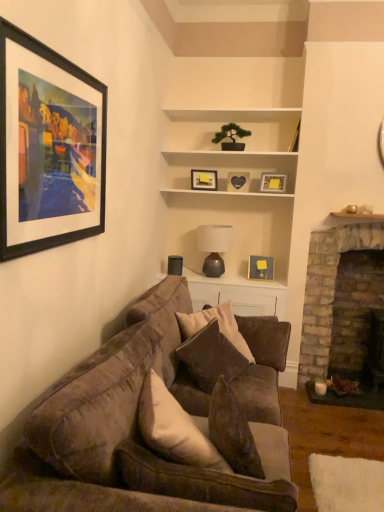
Question: Is white matte cabinet at center thinner than brick fireplace at right?

Choices:
 (A) no
 (B) yes

Answer: (B)

Question: From a real-world perspective, is white matte cabinet at center below brick fireplace at right?

Choices:
 (A) no
 (B) yes

Answer: (A)

Question: From a real-world perspective, is white matte cabinet at center physically above brick fireplace at right?

Choices:
 (A) yes
 (B) no

Answer: (A)

Question: From the image's perspective, is white matte cabinet at center below brick fireplace at right?

Choices:
 (A) yes
 (B) no

Answer: (B)

Question: Does white matte cabinet at center have a smaller size compared to brick fireplace at right?

Choices:
 (A) yes
 (B) no

Answer: (A)

Question: From the image's perspective, is velvet brown couch at lower left, which is counted as the second studio couch, starting from the back, positioned above or below matte gray lamp at center?

Choices:
 (A) above
 (B) below

Answer: (B)

Question: Based on their positions, is velvet brown couch at lower left, which appears as the first studio couch when viewed from the front, located to the left or right of matte gray lamp at center?

Choices:
 (A) left
 (B) right

Answer: (A)

Question: Considering their positions, is velvet brown couch at lower left, which appears as the first studio couch when viewed from the front, located in front of or behind matte gray lamp at center?

Choices:
 (A) front
 (B) behind

Answer: (A)

Question: From a real-world perspective, is velvet brown couch at lower left, which is counted as the second studio couch, starting from the back, above or below matte gray lamp at center?

Choices:
 (A) above
 (B) below

Answer: (B)

Question: Is wooden heart at center, marked as the 3th picture frame in a left-to-right arrangement, in front of or behind matte gray lamp at center in the image?

Choices:
 (A) front
 (B) behind

Answer: (B)

Question: From the image's perspective, is wooden heart at center, marked as the 3th picture frame in a left-to-right arrangement, located above or below matte gray lamp at center?

Choices:
 (A) above
 (B) below

Answer: (A)

Question: From a real-world perspective, is wooden heart at center, which is the third picture frame from back to front, positioned above or below matte gray lamp at center?

Choices:
 (A) above
 (B) below

Answer: (A)

Question: In terms of size, does wooden heart at center, acting as the 3th picture frame starting from the right, appear bigger or smaller than matte gray lamp at center?

Choices:
 (A) big
 (B) small

Answer: (B)

Question: Is matte gray lamp at center inside the boundaries of wooden heart at center, acting as the 3th picture frame starting from the right, or outside?

Choices:
 (A) outside
 (B) inside

Answer: (A)

Question: In the image, is matte gray lamp at center on the left side or the right side of wooden heart at center, marked as the 3th picture frame in a left-to-right arrangement?

Choices:
 (A) right
 (B) left

Answer: (B)